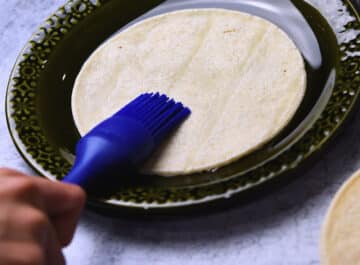
I want to click on reflection of light on plate, so click(x=304, y=36), click(x=335, y=20).